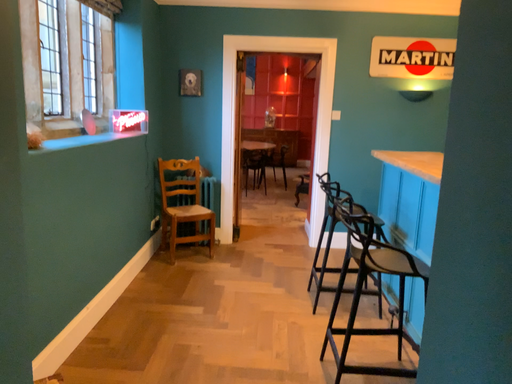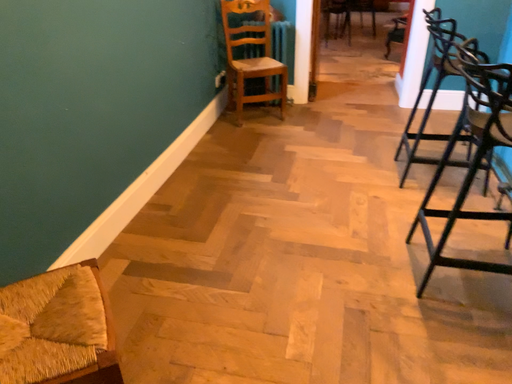
Question: How did the camera likely rotate when shooting the video?

Choices:
 (A) rotated downward
 (B) rotated upward

Answer: (A)